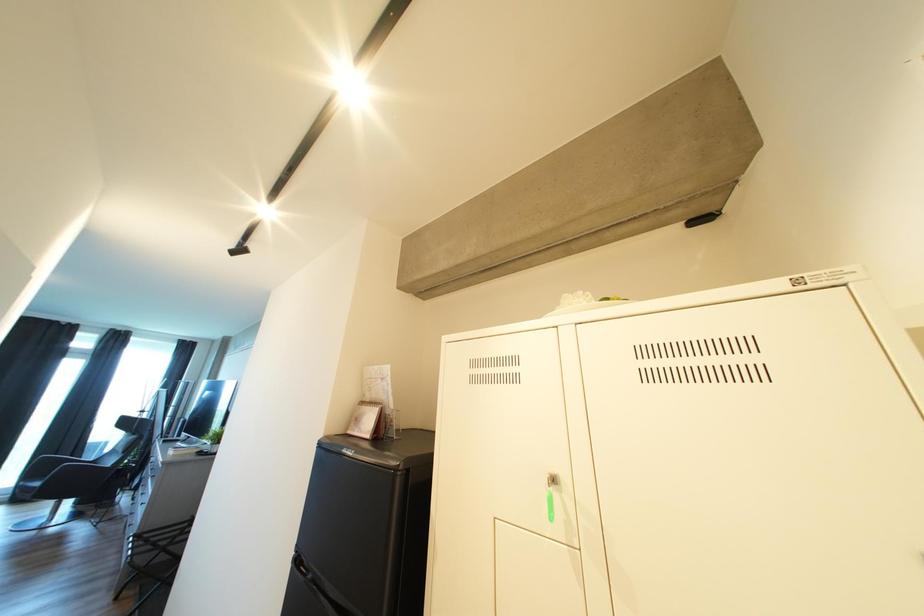
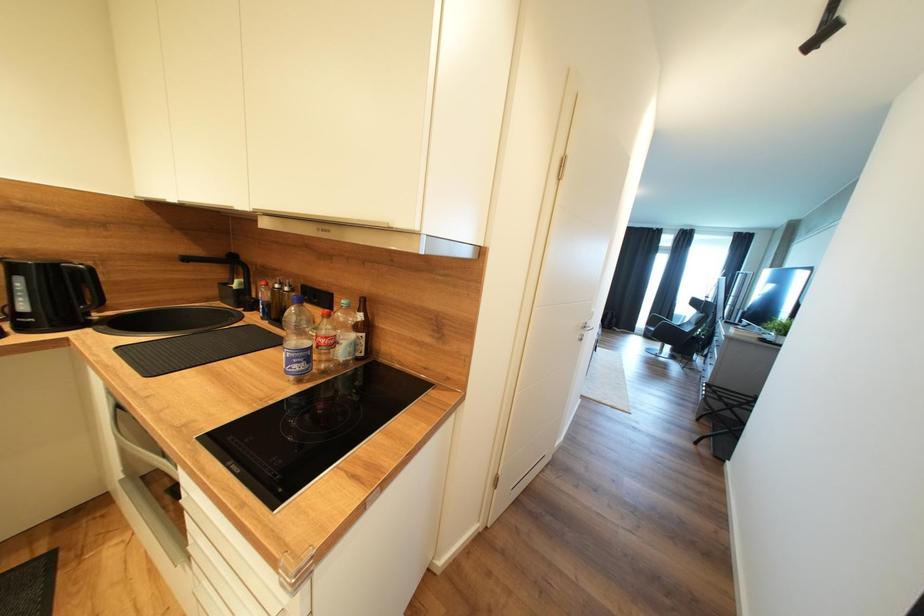
Question: The camera is either moving clockwise (left) or counter-clockwise (right) around the object. The first image is from the beginning of the video and the second image is from the end. Is the camera moving left or right when shooting the video?

Choices:
 (A) Left
 (B) Right

Answer: (B)